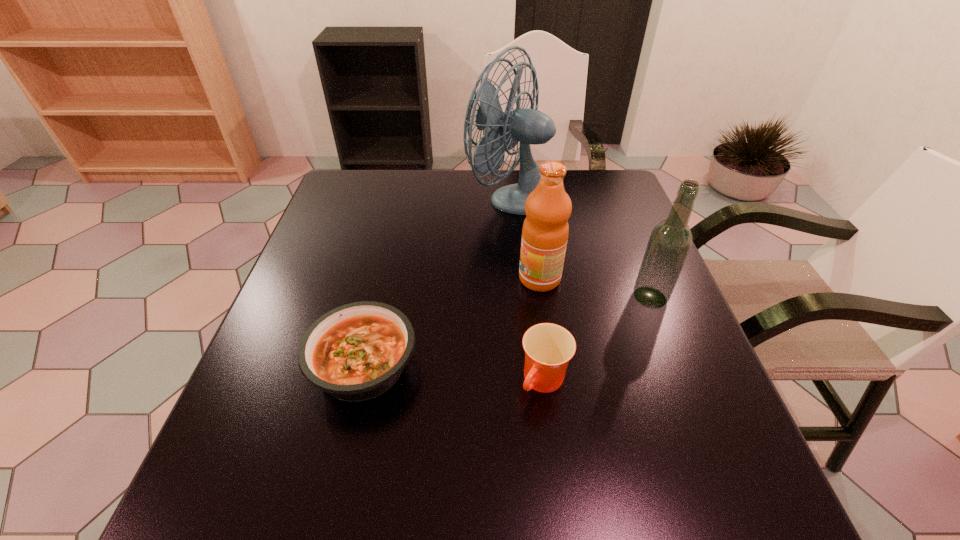
What are the coordinates of `vacant space at the left edge` in the screenshot? It's located at (271, 371).

This screenshot has height=540, width=960. In the image, there is a desktop. Identify the location of vacant space at the right edge. (644, 359).

Identify the location of free spot at the far right corner of the desktop. (587, 195).

Find the location of a particular element. empty space between the fruit juice and the liquor is located at coordinates (595, 288).

Identify the location of free point between the fruit juice and the shortest object. This screenshot has width=960, height=540. (452, 322).

Locate an element on the screen. empty space that is in between the shortest object and the rightmost object is located at coordinates (507, 332).

I want to click on free point between the rightmost object and the shortest object, so click(x=507, y=332).

Identify the location of free space between the cup and the liquor. (597, 339).

This screenshot has width=960, height=540. Identify the location of empty location between the shortest object and the farthest object. (440, 281).

Identify the location of object that is the third nearest to the rightmost object. (529, 126).